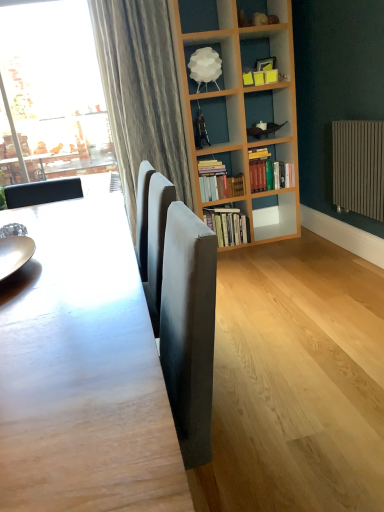
This screenshot has height=512, width=384. What are the coordinates of `free space below brown metallic radiator at right (from a real-world perspective)` in the screenshot? It's located at (359, 263).